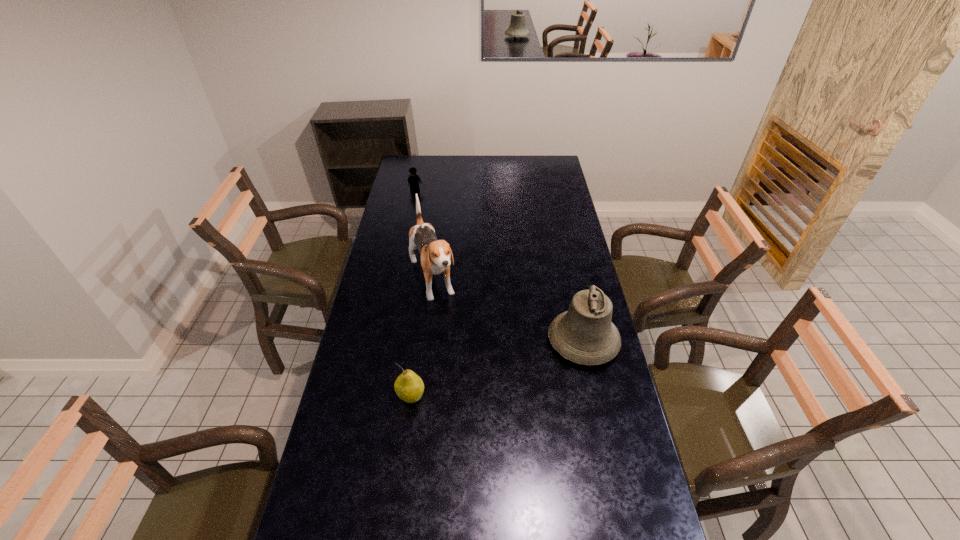
The image size is (960, 540). What are the coordinates of `pear` in the screenshot? It's located at (409, 387).

Where is `the third shortest object`? This screenshot has height=540, width=960. the third shortest object is located at coordinates (584, 334).

Identify the location of bell. (584, 334).

At what (x,y) coordinates should I click in order to perform the action: click on the tallest object. Please return your answer as a coordinate pair (x, y). This screenshot has height=540, width=960. Looking at the image, I should click on (436, 254).

Where is `the second farthest object`? the second farthest object is located at coordinates (436, 254).

The width and height of the screenshot is (960, 540). Find the location of `the farthest object`. the farthest object is located at coordinates (414, 180).

Where is `vacant space located 0.240m on the right of the pear`? The width and height of the screenshot is (960, 540). vacant space located 0.240m on the right of the pear is located at coordinates (500, 397).

At what (x,y) coordinates should I click in order to perform the action: click on vacant area located 0.220m on the left of the rightmost object. Please return your answer as a coordinate pair (x, y). Looking at the image, I should click on (486, 341).

This screenshot has width=960, height=540. Identify the location of free region located at the face of the tallest object. (464, 368).

This screenshot has height=540, width=960. I want to click on free space located at the face of the tallest object, so click(452, 342).